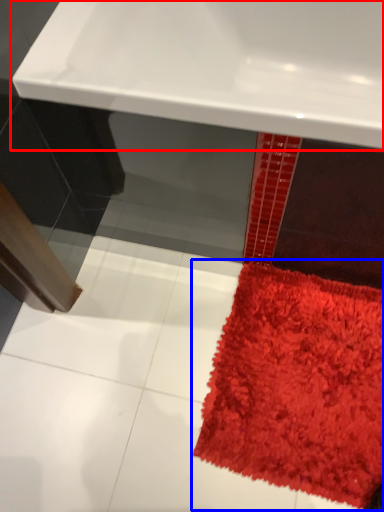
Question: Which object is closer to the camera taking this photo, sink (highlighted by a red box) or mat (highlighted by a blue box)?

Choices:
 (A) sink
 (B) mat

Answer: (A)